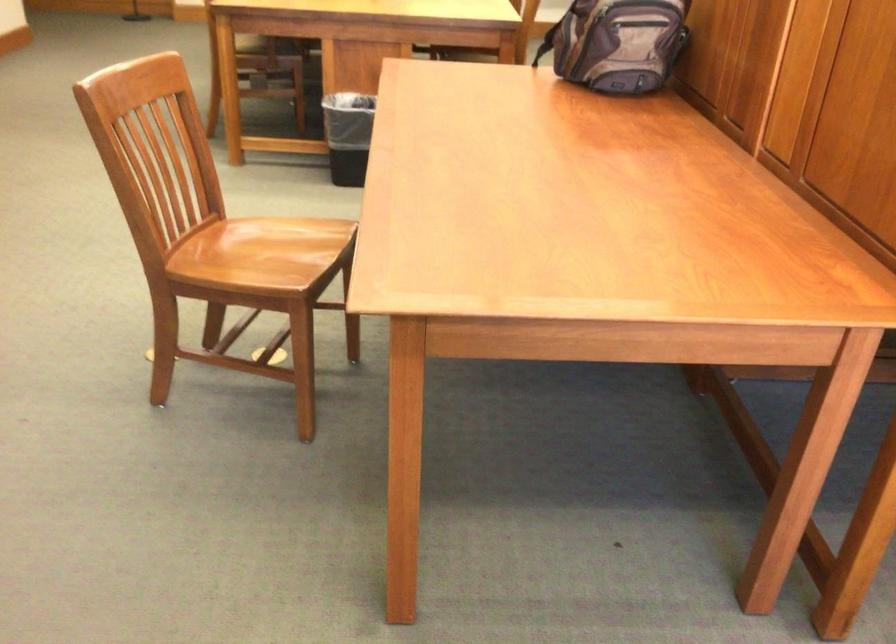
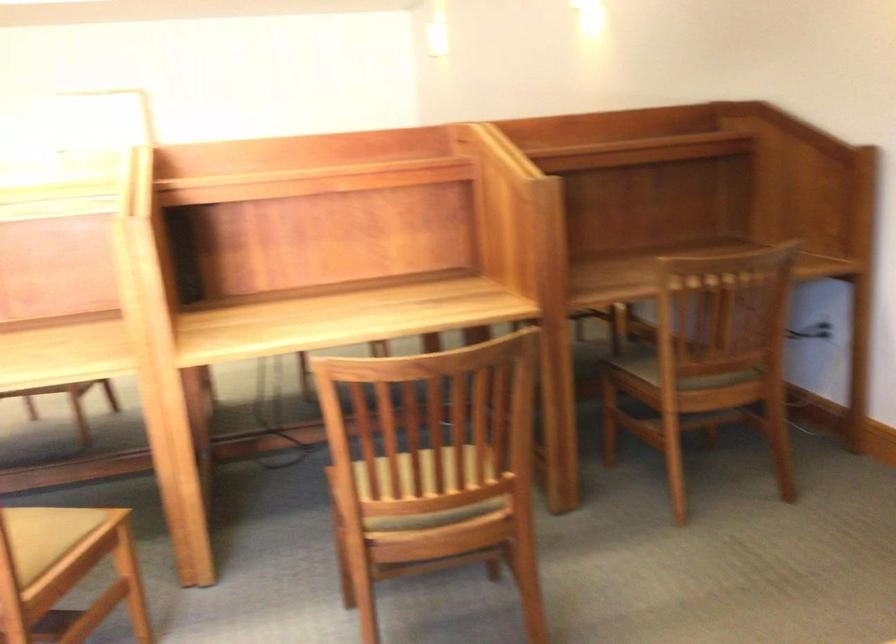
In a continuous first-person perspective shot, in which direction is the camera moving?

The movement direction of the cameraman is right, backward.